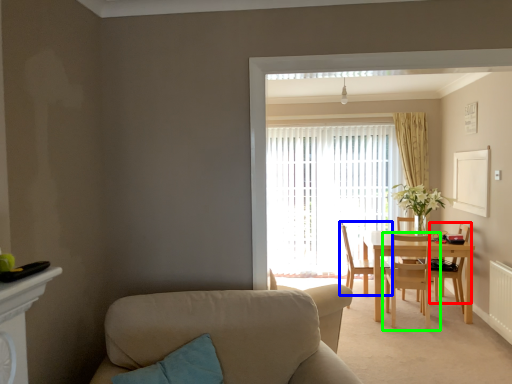
Question: Which object is positioned farthest from chair (highlighted by a red box)? Select from chair (highlighted by a blue box) and chair (highlighted by a green box).

Choices:
 (A) chair
 (B) chair

Answer: (A)